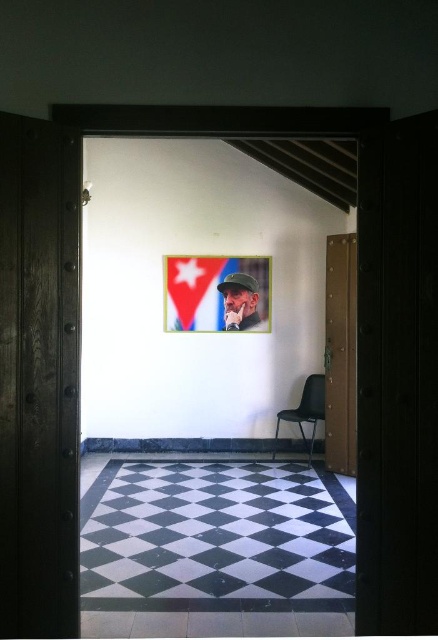
Question: Which object is closer to the camera taking this photo?

Choices:
 (A) matte cardboard poster at center
 (B) matte black portrait at center

Answer: (A)

Question: Where is matte cardboard poster at center located in relation to matte black portrait at center in the image?

Choices:
 (A) left
 (B) right

Answer: (A)

Question: Does matte cardboard poster at center have a greater width compared to black plastic chair at center?

Choices:
 (A) no
 (B) yes

Answer: (B)

Question: Which is nearer to the matte black portrait at center?

Choices:
 (A) matte cardboard poster at center
 (B) black plastic chair at center

Answer: (A)

Question: Is matte cardboard poster at center smaller than black plastic chair at center?

Choices:
 (A) yes
 (B) no

Answer: (A)

Question: Considering the real-world distances, which object is farthest from the matte black portrait at center?

Choices:
 (A) black plastic chair at center
 (B) matte cardboard poster at center

Answer: (A)